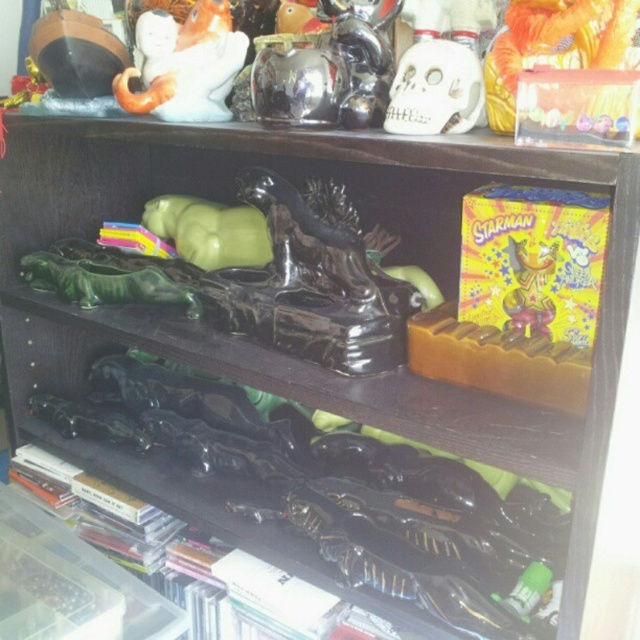
Based on the photo, who is positioned more to the left, orange plastic toy at upper right or white matte skull at upper center?

Positioned to the left is white matte skull at upper center.

Does orange plastic toy at upper right have a smaller size compared to white matte skull at upper center?

Actually, orange plastic toy at upper right might be larger than white matte skull at upper center.

Is point (600, 26) more distant than point (408, 132)?

No.

Locate an element on the screen. This screenshot has height=640, width=640. orange plastic toy at upper right is located at coordinates (554, 45).

Based on the photo, is green rubber toy at center positioned behind shiny yellow plastic toy at upper right?

Yes, green rubber toy at center is further from the viewer.

Consider the image. Does green rubber toy at center have a lesser height compared to shiny yellow plastic toy at upper right?

No, green rubber toy at center is not shorter than shiny yellow plastic toy at upper right.

Which is behind, point (177, 196) or point (554, 243)?

Positioned behind is point (177, 196).

Locate an element on the screen. The width and height of the screenshot is (640, 640). green rubber toy at center is located at coordinates (209, 230).

Between white glossy statue at upper left and orange plastic toy at upper right, which one is positioned higher?

white glossy statue at upper left is above.

Identify the location of white glossy statue at upper left. The image size is (640, 640). click(x=184, y=65).